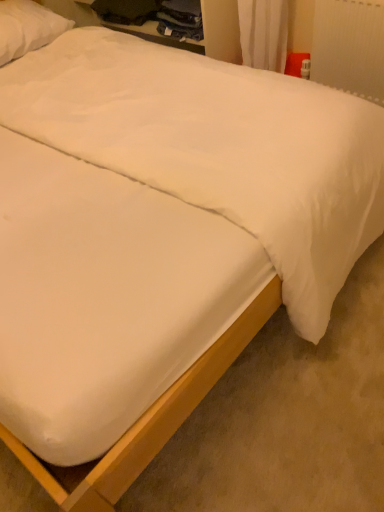
In order to click on white soft pillow at upper left in this screenshot , I will do `click(27, 28)`.

This screenshot has height=512, width=384. What do you see at coordinates (349, 47) in the screenshot? I see `white plastic radiator at upper right` at bounding box center [349, 47].

You are a GUI agent. You are given a task and a screenshot of the screen. Output one action in this format:
    pyautogui.click(x=<x>, y=<y>)
    Task: Click on the white smooth mattress at center
    
    Given the screenshot: What is the action you would take?
    click(x=104, y=297)

Where is `white soft pillow at upper left`? The width and height of the screenshot is (384, 512). white soft pillow at upper left is located at coordinates (27, 28).

From a real-world perspective, is white soft pillow at upper left positioned over white plastic radiator at upper right based on gravity?

Correct, in the physical world, white soft pillow at upper left is higher than white plastic radiator at upper right.

Considering the positions of points (14, 29) and (345, 52), is point (14, 29) closer to camera compared to point (345, 52)?

No.

Which of these two, white soft pillow at upper left or white plastic radiator at upper right, is wider?

white soft pillow at upper left is wider.

The height and width of the screenshot is (512, 384). In the image, there is a white soft pillow at upper left. Find the location of `radiator below it (from a real-world perspective)`. radiator below it (from a real-world perspective) is located at coordinates (349, 47).

From a real-world perspective, who is located lower, white plastic radiator at upper right or white soft pillow at upper left?

white plastic radiator at upper right.

Considering the positions of objects white plastic radiator at upper right and white soft pillow at upper left in the image provided, who is more to the right, white plastic radiator at upper right or white soft pillow at upper left?

white plastic radiator at upper right is more to the right.

From the picture: From the image's perspective, is white plastic radiator at upper right above or below white soft pillow at upper left?

white plastic radiator at upper right is situated lower than white soft pillow at upper left in the image.

The image size is (384, 512). Find the location of `radiator above the white smooth mattress at center (from a real-world perspective)`. radiator above the white smooth mattress at center (from a real-world perspective) is located at coordinates (349, 47).

From a real-world perspective, is white smooth mattress at center positioned above or below white plastic radiator at upper right?

In terms of real-world spatial position, white smooth mattress at center is below white plastic radiator at upper right.

Is white smooth mattress at center to the right of white plastic radiator at upper right from the viewer's perspective?

Incorrect, white smooth mattress at center is not on the right side of white plastic radiator at upper right.

Is white smooth mattress at center not inside white plastic radiator at upper right?

white smooth mattress at center lies outside white plastic radiator at upper right's area.

From a real-world perspective, who is located higher, white smooth mattress at center or white soft pillow at upper left?

white soft pillow at upper left, from a real-world perspective.

Considering the relative positions of white smooth mattress at center and white soft pillow at upper left in the image provided, is white smooth mattress at center to the left of white soft pillow at upper left from the viewer's perspective?

In fact, white smooth mattress at center is to the right of white soft pillow at upper left.

Does white smooth mattress at center contain white soft pillow at upper left?

Actually, white soft pillow at upper left is outside white smooth mattress at center.

From the picture: How different are the orientations of white smooth mattress at center and white soft pillow at upper left in degrees?

There is a 0.736-degree angle between the facing directions of white smooth mattress at center and white soft pillow at upper left.

Is white plastic radiator at upper right beside white smooth mattress at center?

No, white plastic radiator at upper right is not next to white smooth mattress at center.

Is white plastic radiator at upper right smaller than white smooth mattress at center?

Yes, white plastic radiator at upper right is smaller than white smooth mattress at center.

Can you confirm if white plastic radiator at upper right is positioned to the right of white smooth mattress at center?

Yes, white plastic radiator at upper right is to the right of white smooth mattress at center.

Considering the relative sizes of white plastic radiator at upper right and white smooth mattress at center in the image provided, is white plastic radiator at upper right wider than white smooth mattress at center?

No, white plastic radiator at upper right is not wider than white smooth mattress at center.

Could white smooth mattress at center be considered to be inside white soft pillow at upper left?

No.

Is white soft pillow at upper left positioned in front of white smooth mattress at center?

That is False.

Is white soft pillow at upper left smaller than white smooth mattress at center?

Yes, white soft pillow at upper left is smaller than white smooth mattress at center.

Is point (13, 56) farther from viewer compared to point (112, 340)?

That is True.

Where is `radiator on the right side of white soft pillow at upper left`? radiator on the right side of white soft pillow at upper left is located at coordinates (349, 47).

The height and width of the screenshot is (512, 384). Identify the location of radiator lying below the white soft pillow at upper left (from the image's perspective). (349, 47).

Based on their spatial positions, is white soft pillow at upper left or white smooth mattress at center closer to white plastic radiator at upper right?

The object closer to white plastic radiator at upper right is white soft pillow at upper left.

Based on their spatial positions, is white plastic radiator at upper right or white soft pillow at upper left further from white smooth mattress at center?

The object further to white smooth mattress at center is white soft pillow at upper left.

Considering their positions, is white smooth mattress at center positioned closer to white plastic radiator at upper right than white soft pillow at upper left?

white soft pillow at upper left is closer to white plastic radiator at upper right.

Estimate the real-world distances between objects in this image. Which object is closer to white smooth mattress at center, white soft pillow at upper left or white plastic radiator at upper right?

white plastic radiator at upper right lies closer to white smooth mattress at center than the other object.

From the image, which object appears to be nearer to white soft pillow at upper left, white plastic radiator at upper right or white smooth mattress at center?

white plastic radiator at upper right is closer to white soft pillow at upper left.

Which object lies further to the anchor point white soft pillow at upper left, white smooth mattress at center or white plastic radiator at upper right?

white smooth mattress at center.

Where is `mattress between white soft pillow at upper left and white plastic radiator at upper right from left to right`? mattress between white soft pillow at upper left and white plastic radiator at upper right from left to right is located at coordinates (104, 297).